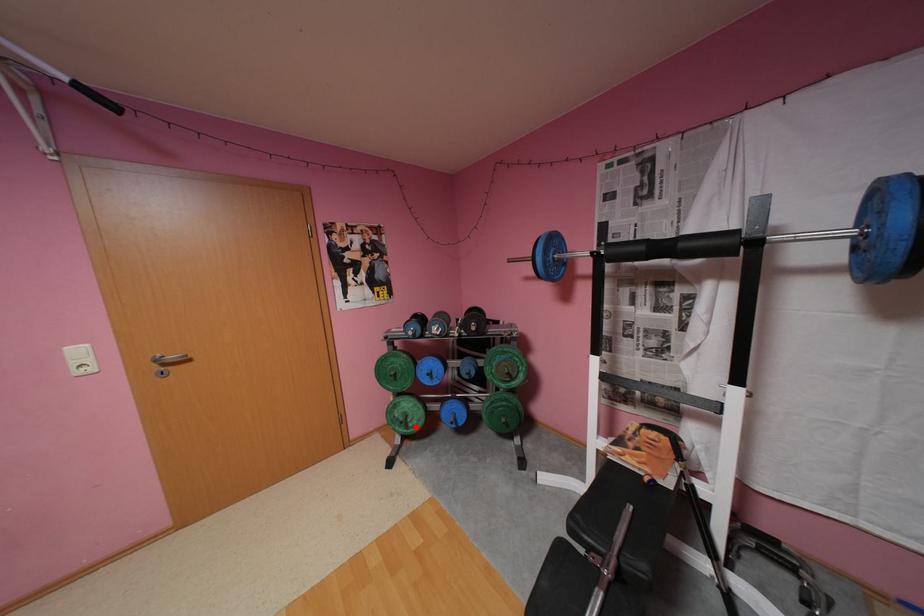
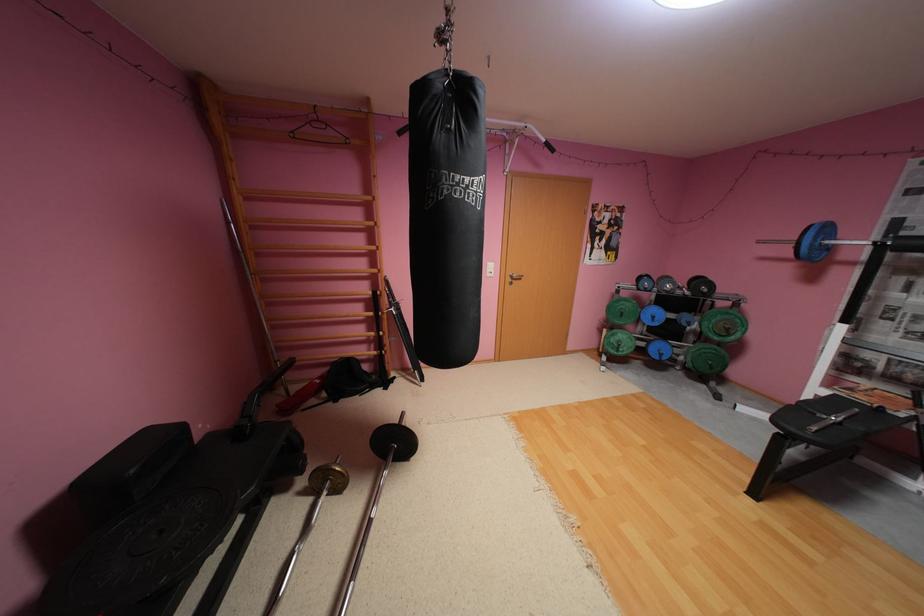
In the second image, find the point that corresponds to the highlighted location in the first image.

(626, 351)